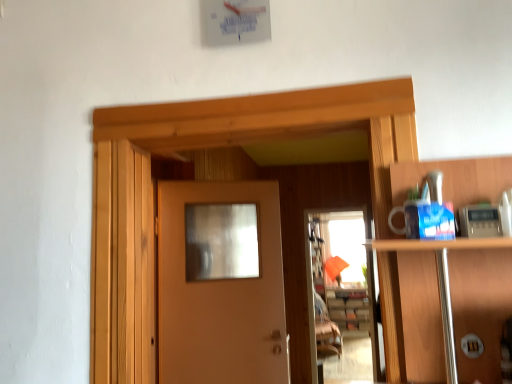
Question: Can you confirm if wooden cabinet at center is thinner than translucent glass screen door at center?

Choices:
 (A) no
 (B) yes

Answer: (A)

Question: Is wooden cabinet at center facing towards translucent glass screen door at center?

Choices:
 (A) yes
 (B) no

Answer: (A)

Question: From a real-world perspective, is wooden cabinet at center below translucent glass screen door at center?

Choices:
 (A) yes
 (B) no

Answer: (A)

Question: From the image's perspective, does wooden cabinet at center appear lower than translucent glass screen door at center?

Choices:
 (A) no
 (B) yes

Answer: (B)

Question: Considering the relative sizes of wooden cabinet at center and translucent glass screen door at center in the image provided, is wooden cabinet at center smaller than translucent glass screen door at center?

Choices:
 (A) yes
 (B) no

Answer: (B)

Question: Is wooden cabinet at center bigger than translucent glass screen door at center?

Choices:
 (A) yes
 (B) no

Answer: (A)

Question: Does matte wood door at center appear on the left side of wooden cabinet at center?

Choices:
 (A) yes
 (B) no

Answer: (A)

Question: Is matte wood door at center positioned in front of wooden cabinet at center?

Choices:
 (A) no
 (B) yes

Answer: (B)

Question: Is matte wood door at center looking in the opposite direction of wooden cabinet at center?

Choices:
 (A) yes
 (B) no

Answer: (B)

Question: Is matte wood door at center not inside wooden cabinet at center?

Choices:
 (A) no
 (B) yes

Answer: (B)

Question: Considering the relative sizes of matte wood door at center and wooden cabinet at center in the image provided, is matte wood door at center taller than wooden cabinet at center?

Choices:
 (A) no
 (B) yes

Answer: (B)

Question: Is matte wood door at center to the right of wooden cabinet at center from the viewer's perspective?

Choices:
 (A) no
 (B) yes

Answer: (A)

Question: Is translucent glass screen door at center to the right of wooden cabinet at center from the viewer's perspective?

Choices:
 (A) yes
 (B) no

Answer: (B)